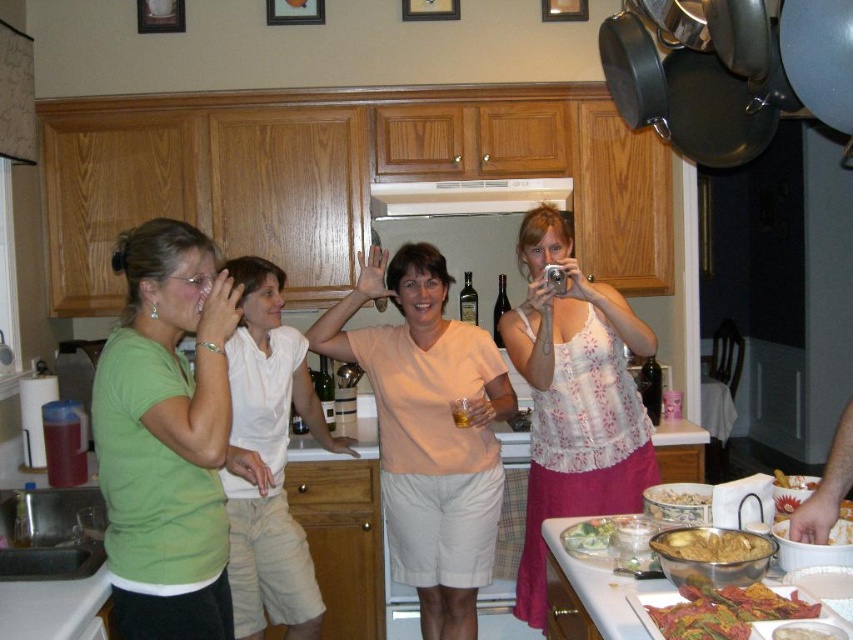
Can you confirm if green matte shirt at left is taller than tomato sauce coated pasta at center?

Yes.

This screenshot has height=640, width=853. Find the location of `green matte shirt at left`. green matte shirt at left is located at coordinates (167, 436).

Is matte peach shirt at center positioned behind shiny metallic bowl at center right?

Yes.

You are a GUI agent. You are given a task and a screenshot of the screen. Output one action in this format:
    pyautogui.click(x=<x>, y=<y>)
    Task: Click on the matte peach shirt at center
    This screenshot has width=853, height=640.
    Given the screenshot: What is the action you would take?
    pyautogui.click(x=428, y=429)

Identify the location of matte peach shirt at center. This screenshot has height=640, width=853. [x=428, y=429].

Who is positioned more to the right, green matte shirt at left or smooth white pasta at lower right?

From the viewer's perspective, smooth white pasta at lower right appears more on the right side.

Looking at this image, who is higher up, green matte shirt at left or smooth white pasta at lower right?

green matte shirt at left is above.

Does point (177, 424) come closer to viewer compared to point (778, 632)?

No, (177, 424) is behind (778, 632).

At what (x,y) coordinates should I click in order to perform the action: click on green matte shirt at left. Please return your answer as a coordinate pair (x, y). The width and height of the screenshot is (853, 640). Looking at the image, I should click on (167, 436).